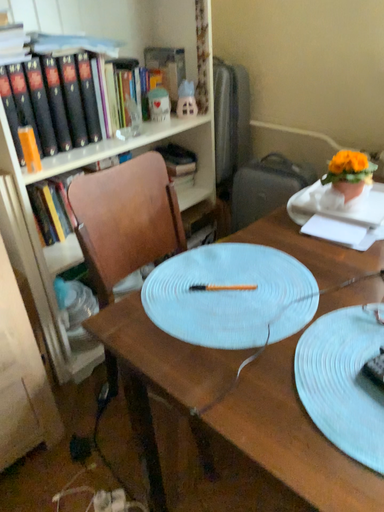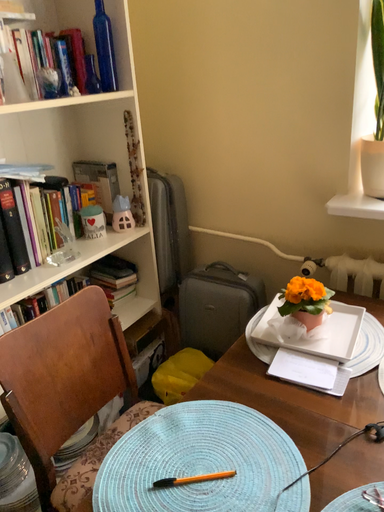
Question: Which way did the camera rotate in the video?

Choices:
 (A) rotated upward
 (B) rotated downward

Answer: (A)